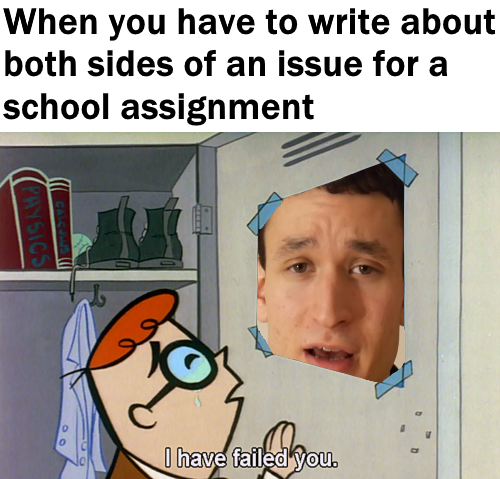
Identify the location of locker door. This screenshot has width=500, height=479. point(237,259).